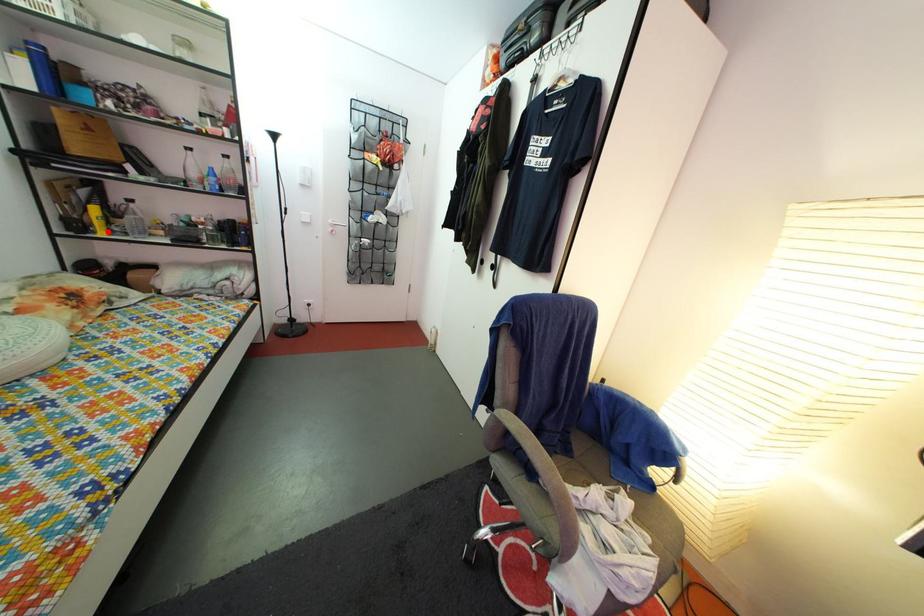
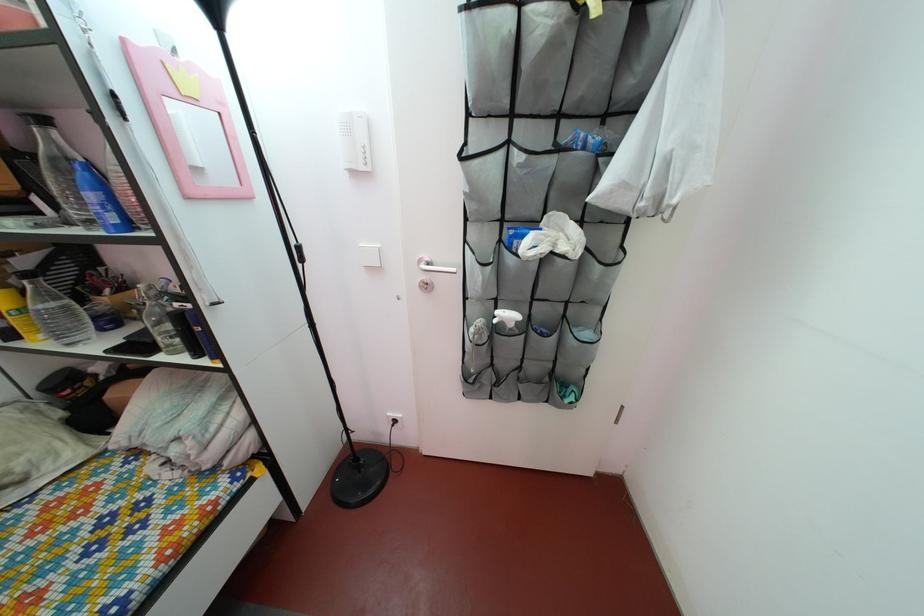
Where in the second image is the point corresponding to the highlighted location from the first image?

(27, 330)